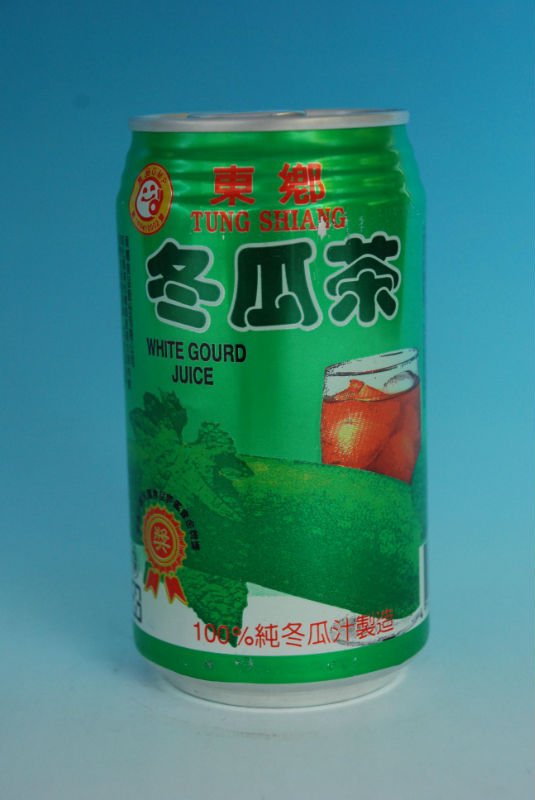
This screenshot has height=800, width=535. Identify the location of wall. (464, 436).